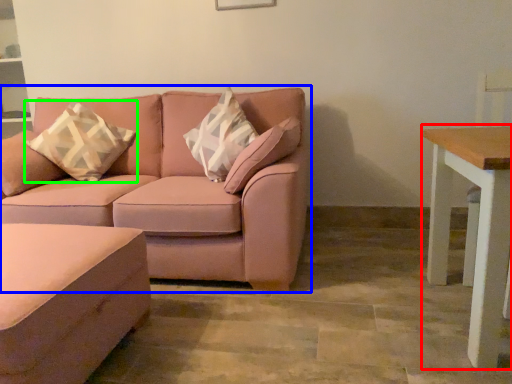
Question: Which object is positioned farthest from table (highlighted by a red box)? Select from studio couch (highlighted by a blue box) and throw pillow (highlighted by a green box).

Choices:
 (A) studio couch
 (B) throw pillow

Answer: (B)